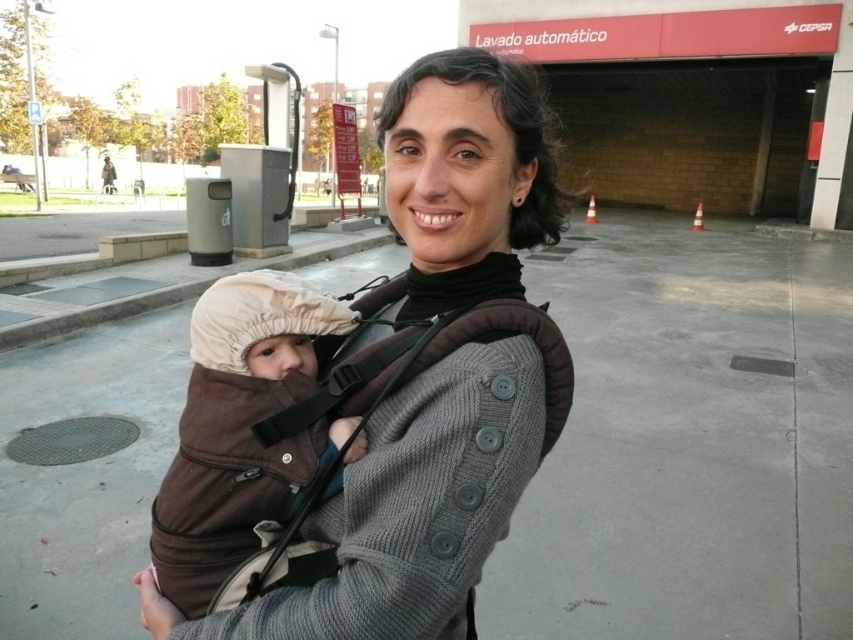
You are a photographer trying to focus on the brown fleece baby at center and the knit gray sweater at center. Which object is located to the left of the other?

The brown fleece baby at center is to the left of the knit gray sweater at center because the knit gray sweater at center is positioned on the right side of brown fleece baby at center.

You are a photographer trying to capture a photo of the knit gray sweater at center and the brown fleece baby at center. Which object should you focus on first if you want to ensure both are in focus without adjusting the camera settings?

The knit gray sweater at center is much taller than the brown fleece baby at center, so focusing on the knit gray sweater at center first will help ensure both are in focus since it is farther away.